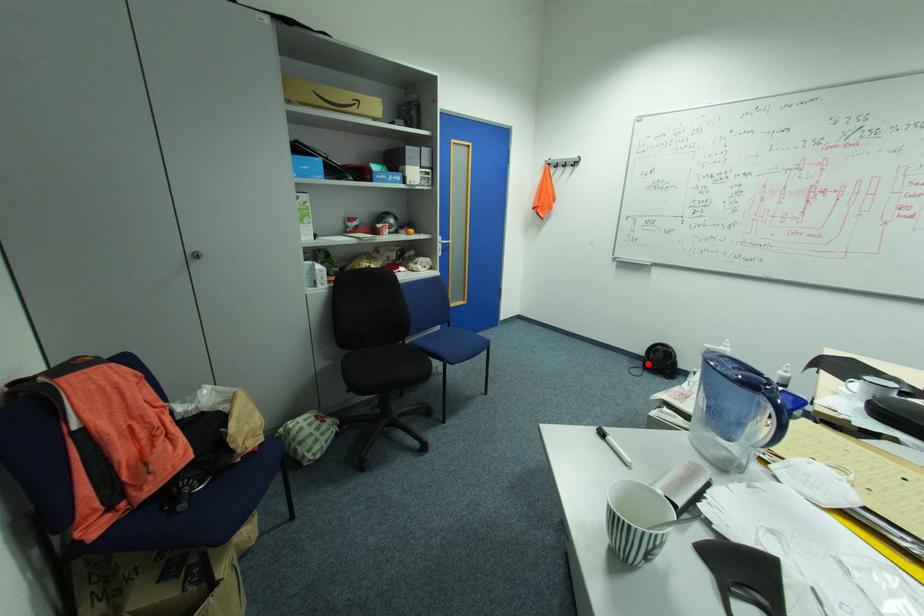
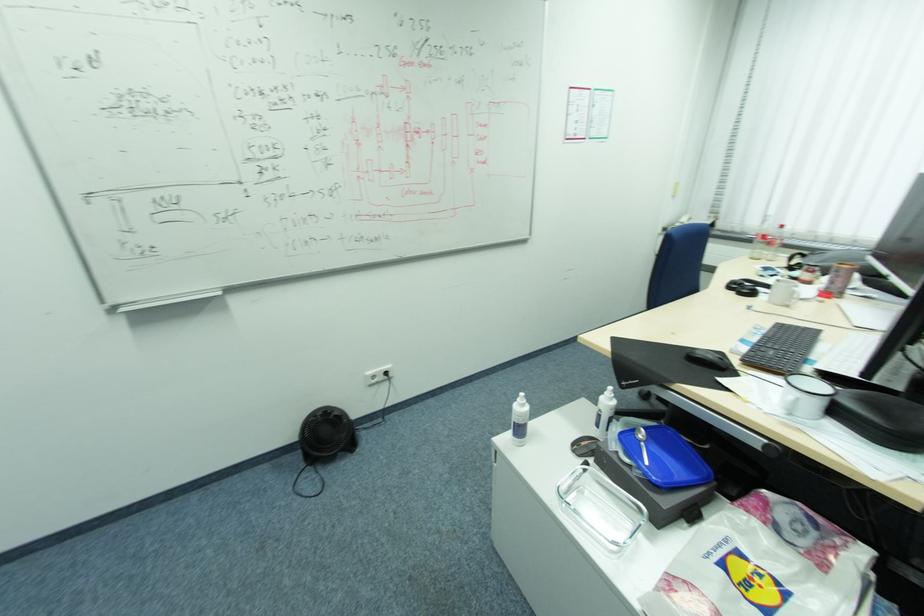
Find the pixel in the second image that matches the highlighted location in the first image.

(304, 456)